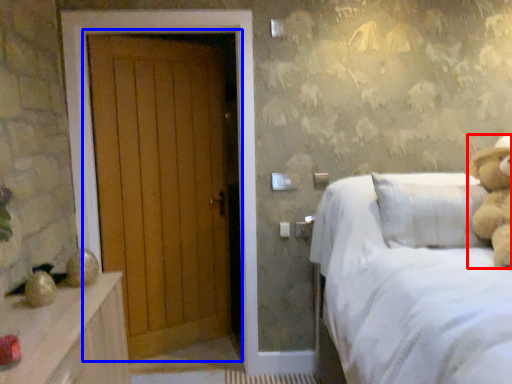
Question: Which object is closer to the camera taking this photo, teddy bear (highlighted by a red box) or door (highlighted by a blue box)?

Choices:
 (A) teddy bear
 (B) door

Answer: (A)